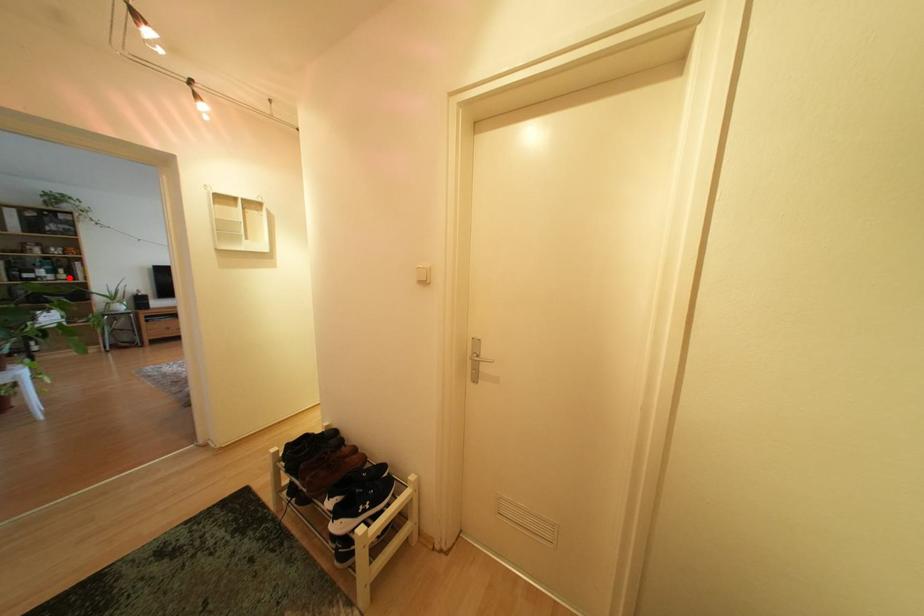
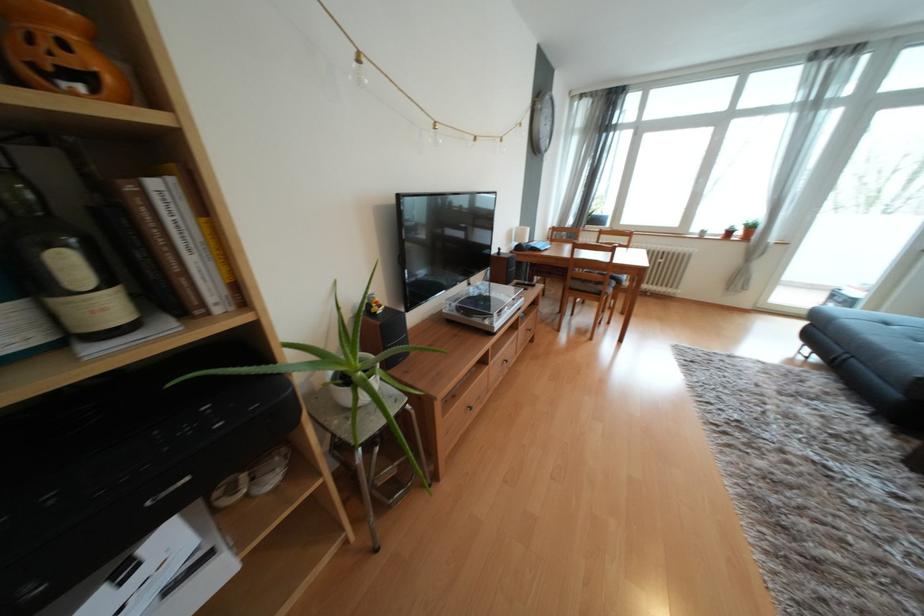
The point at the highlighted location is marked in the first image. Where is the corresponding point in the second image?

(111, 308)